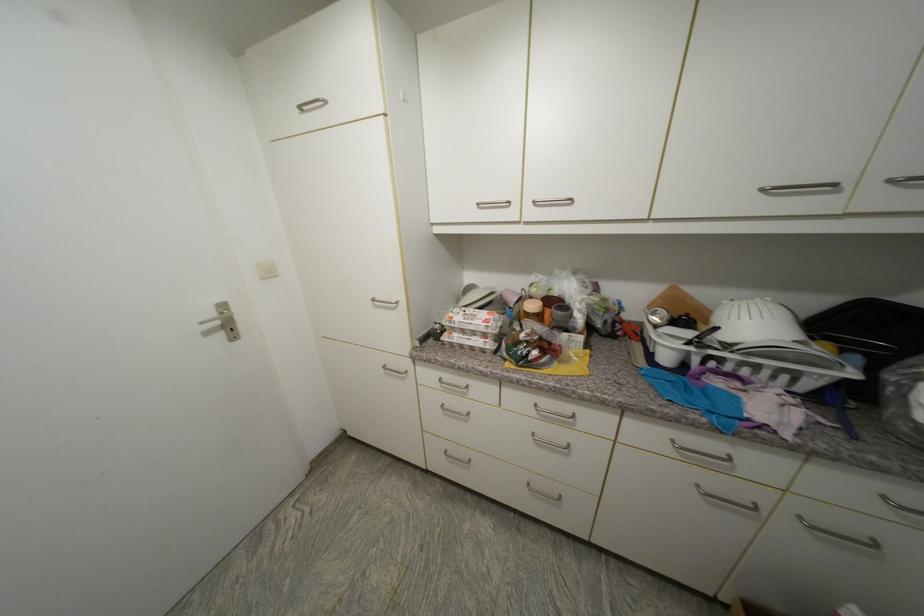
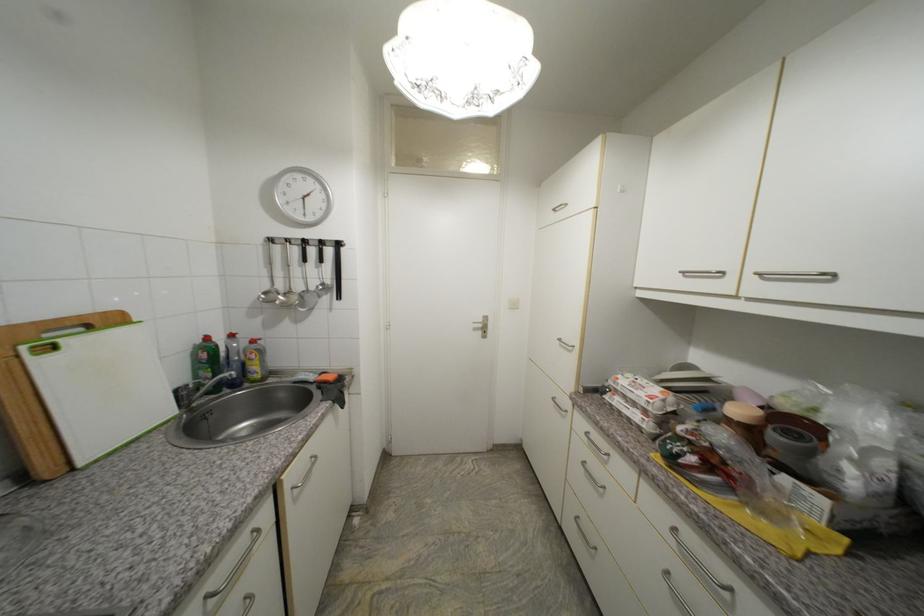
The point at (x=457, y=318) is marked in the first image. Where is the corresponding point in the second image?

(623, 379)